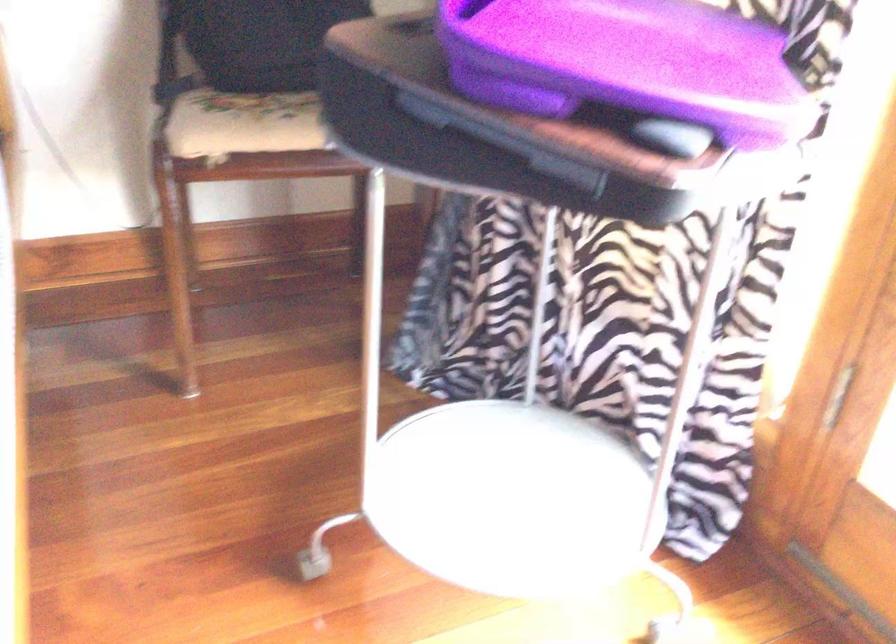
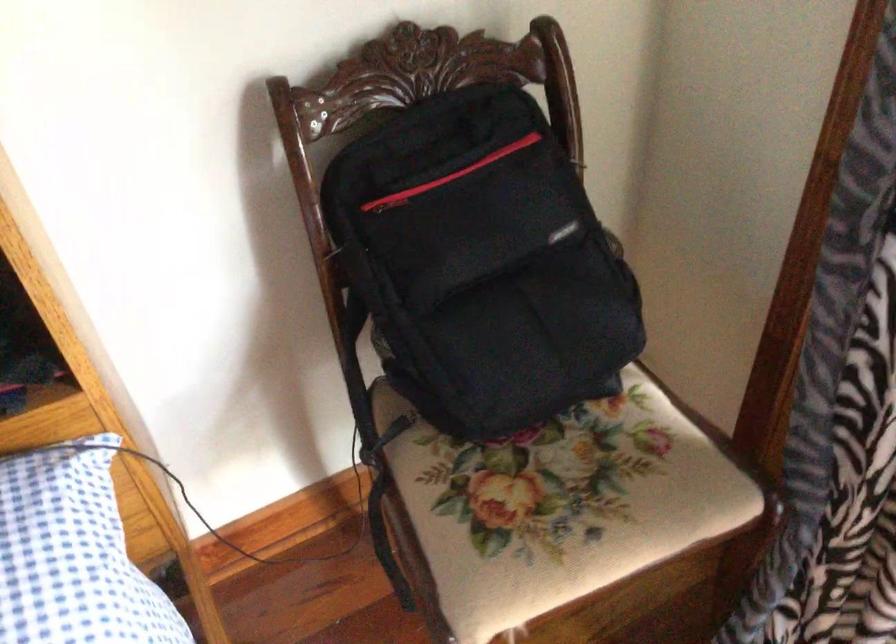
Question: The images are taken continuously from a first-person perspective. In which direction is your viewpoint rotating?

Choices:
 (A) Left
 (B) Right
 (C) Up
 (D) Down

Answer: (D)